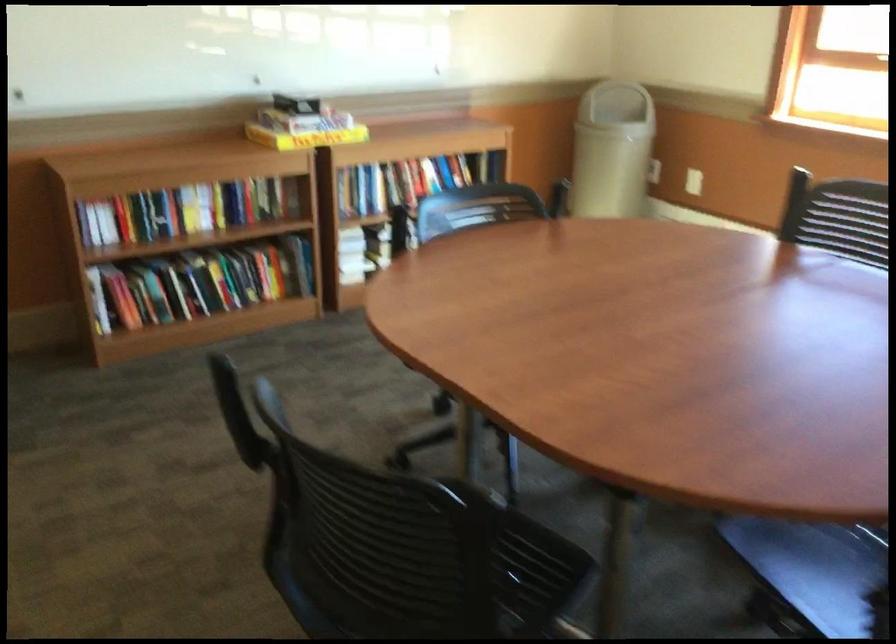
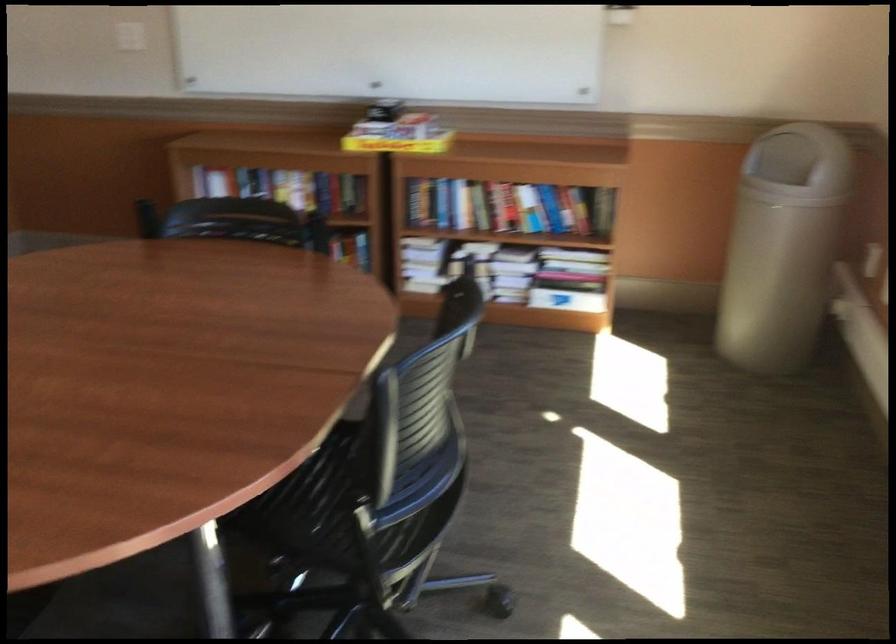
Locate, in the second image, the point that corresponds to (x=280, y=136) in the first image.

(398, 144)